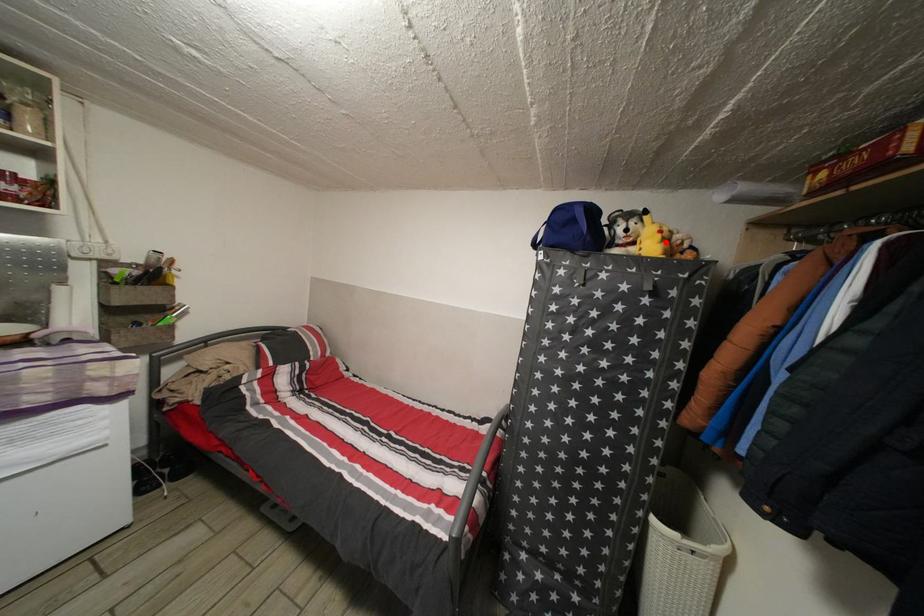
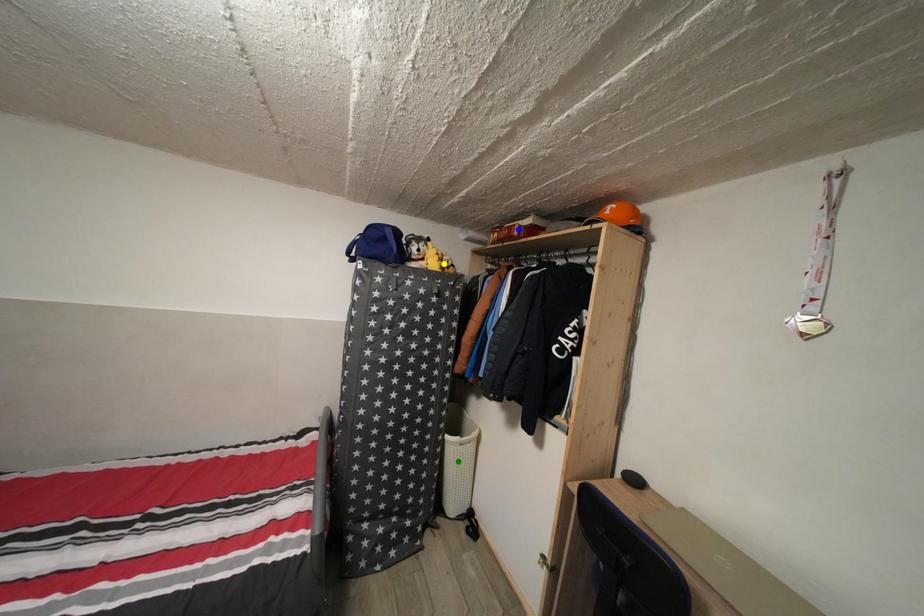
Question: I am providing you with two images of the same scene from different viewpoints. A red point is marked on the first image. You are given multiple points on the second image. Which mark in image 2 goes with the point in image 1?

Choices:
 (A) yellow point
 (B) blue point
 (C) green point

Answer: (A)